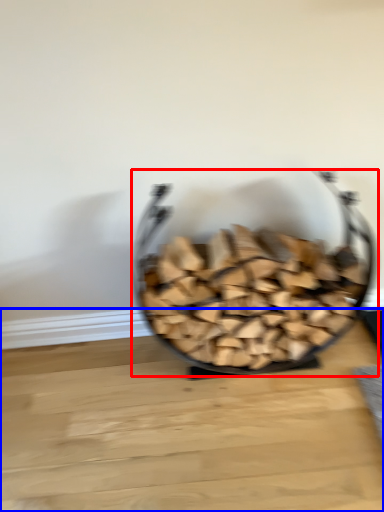
Question: Which object is closer to the camera taking this photo, tableware (highlighted by a red box) or table top (highlighted by a blue box)?

Choices:
 (A) tableware
 (B) table top

Answer: (A)